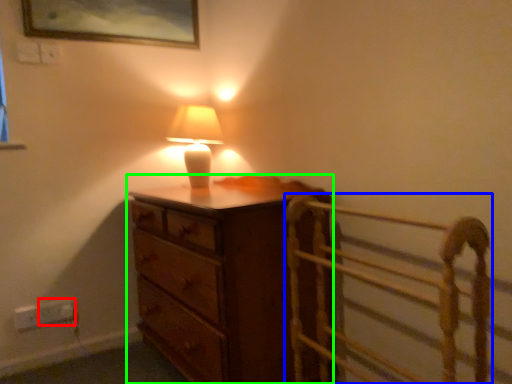
Question: Estimate the real-world distances between objects in this image. Which object is farther from electric outlet (highlighted by a red box), bed frame (highlighted by a blue box) or chest of drawers (highlighted by a green box)?

Choices:
 (A) bed frame
 (B) chest of drawers

Answer: (A)